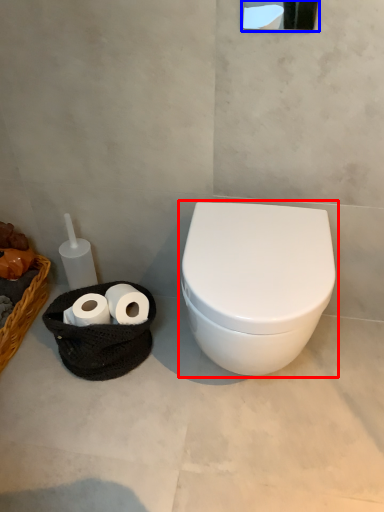
Question: Which of the following is the farthest to the observer, toilet (highlighted by a red box) or mirror (highlighted by a blue box)?

Choices:
 (A) toilet
 (B) mirror

Answer: (A)